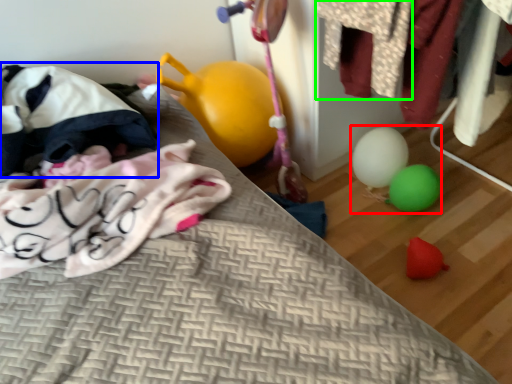
Question: Estimate the real-world distances between objects in this image. Which object is closer to toy (highlighted by a red box), bean bag chair (highlighted by a blue box) or clothing (highlighted by a green box)?

Choices:
 (A) bean bag chair
 (B) clothing

Answer: (B)